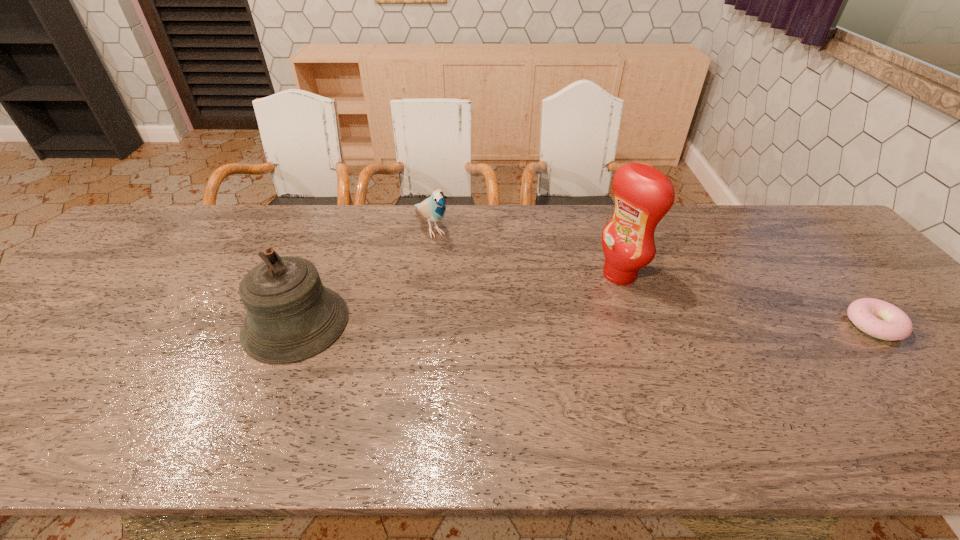
This screenshot has width=960, height=540. What are the coordinates of `vacant area at the left edge` in the screenshot? It's located at (107, 268).

Find the location of `blank space at the right edge of the desktop`. blank space at the right edge of the desktop is located at coordinates (893, 354).

The height and width of the screenshot is (540, 960). Identify the location of vacant region at the far left corner of the desktop. (187, 223).

In the image, there is a desktop. Where is `vacant space at the far right corner`? vacant space at the far right corner is located at coordinates (831, 239).

This screenshot has height=540, width=960. What are the coordinates of `unoccupied area between the condiment and the rightmost object` in the screenshot? It's located at (747, 300).

You are a GUI agent. You are given a task and a screenshot of the screen. Output one action in this format:
    pyautogui.click(x=<x>, y=<y>)
    Task: Click on the empty space that is in between the doughnut and the condiment
    
    Given the screenshot: What is the action you would take?
    pyautogui.click(x=747, y=300)

You are a GUI agent. You are given a task and a screenshot of the screen. Output one action in this format:
    pyautogui.click(x=<x>, y=<y>)
    Task: Click on the free space between the doughnut and the second tallest object
    
    Given the screenshot: What is the action you would take?
    pyautogui.click(x=585, y=324)

Where is `free space between the second object from right to left and the bird`? free space between the second object from right to left and the bird is located at coordinates (525, 251).

Where is `free point between the bell and the second shortest object`? free point between the bell and the second shortest object is located at coordinates (364, 275).

Locate an element on the screen. This screenshot has height=540, width=960. free space between the rightmost object and the farthest object is located at coordinates (653, 276).